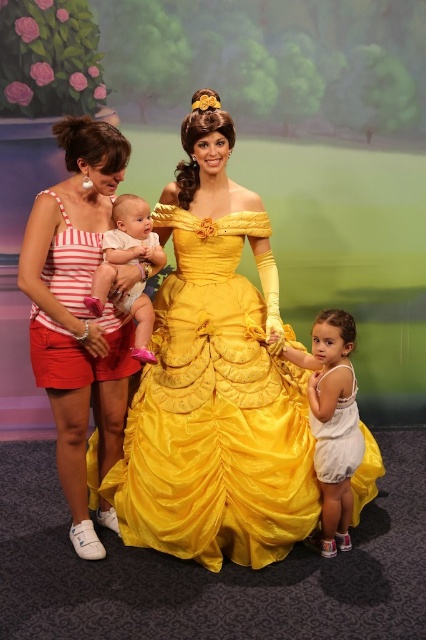
Where is the striped cotton tank top at left located in the image?

The striped cotton tank top at left is located at point (77, 312).

You are a costume designer preparing for a play and have two striped tops to choose from. The first is a striped cotton tank top at left and the second is a striped fabric tank top at left. Which one has a wider design?

The striped cotton tank top at left has a wider design than the striped fabric tank top at left.

You are a photographer positioned at the center of the scene. You want to take a photo focusing on the striped cotton tank top at left and the white cotton dress at lower right. Which of these two items is positioned closer to you?

The striped cotton tank top at left is closer to the viewer than the white cotton dress at lower right, so the striped cotton tank top at left would be the one closer to you.